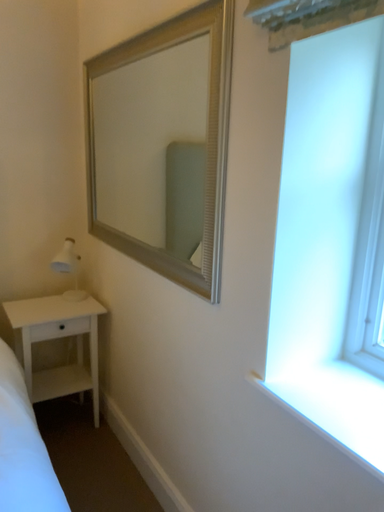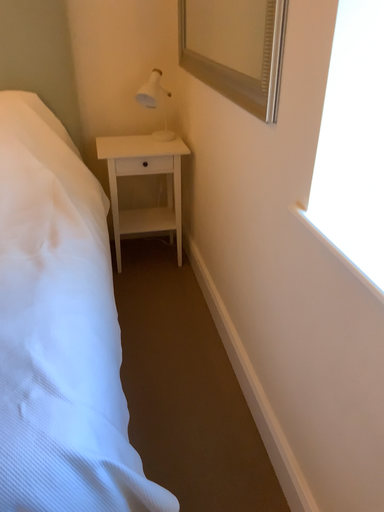
Question: Which way did the camera rotate in the video?

Choices:
 (A) rotated upward
 (B) rotated downward

Answer: (B)